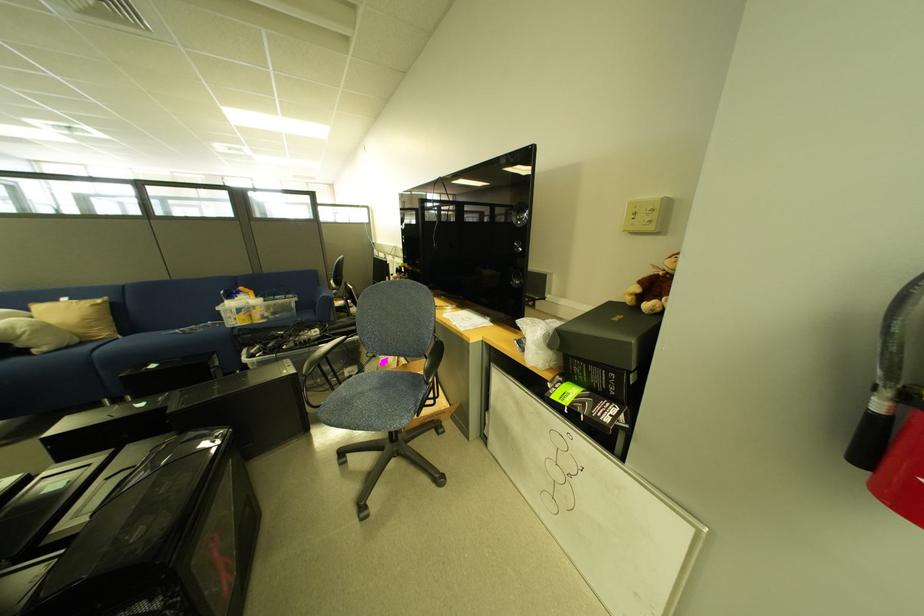
This screenshot has height=616, width=924. What do you see at coordinates (154, 543) in the screenshot? I see `the black box lid` at bounding box center [154, 543].